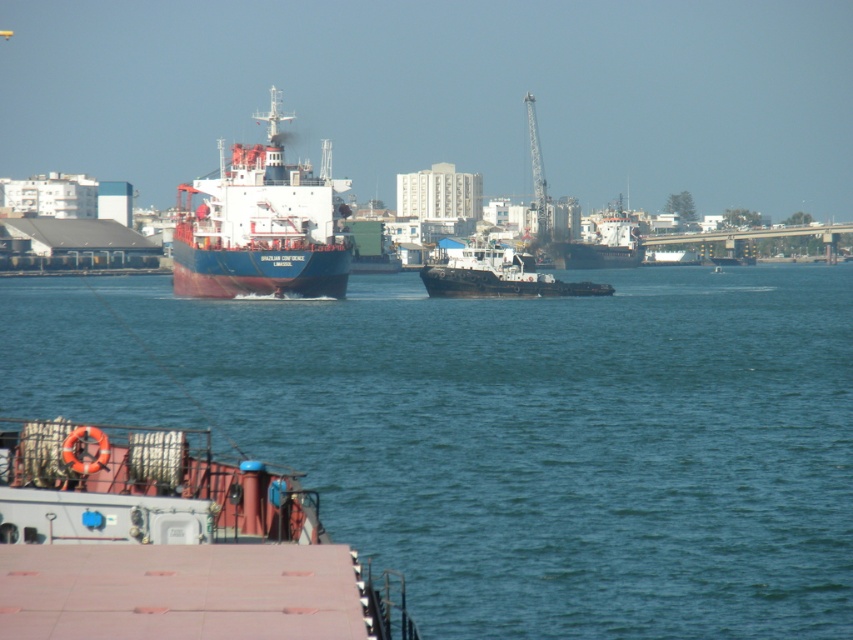
Does rustic metal barge at lower left have a greater height compared to blue matte cargo ship at center?

In fact, rustic metal barge at lower left may be shorter than blue matte cargo ship at center.

Identify the location of rustic metal barge at lower left. This screenshot has width=853, height=640. (170, 544).

Find the location of a particular element. rustic metal barge at lower left is located at coordinates (170, 544).

In the scene shown: Can you confirm if black matte tugboat at center is positioned to the right of dark gray matte cargo ship at center?

In fact, black matte tugboat at center is to the left of dark gray matte cargo ship at center.

You are a GUI agent. You are given a task and a screenshot of the screen. Output one action in this format:
    pyautogui.click(x=<x>, y=<y>)
    Task: Click on the black matte tugboat at center
    The height and width of the screenshot is (640, 853).
    Given the screenshot: What is the action you would take?
    pyautogui.click(x=496, y=275)

Where is `black matte tugboat at center`? black matte tugboat at center is located at coordinates (496, 275).

Which is behind, point (546, 278) or point (543, 225)?

Point (543, 225)

Who is higher up, black matte tugboat at center or metallic gray crane at upper center?

metallic gray crane at upper center is above.

At what (x,y) coordinates should I click in order to perform the action: click on black matte tugboat at center. Please return your answer as a coordinate pair (x, y). Looking at the image, I should click on (496, 275).

Find the location of a particular element. black matte tugboat at center is located at coordinates (496, 275).